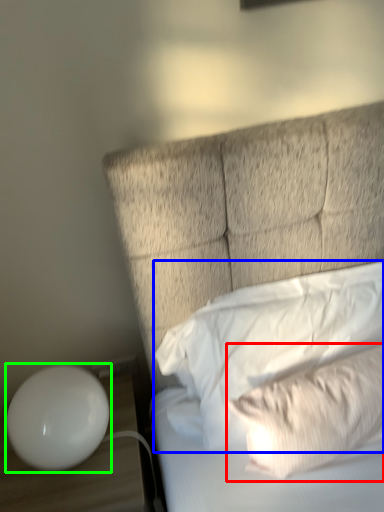
Question: Which is farther away from pillow (highlighted by a red box)? pillow (highlighted by a blue box) or table lamp (highlighted by a green box)?

Choices:
 (A) pillow
 (B) table lamp

Answer: (B)